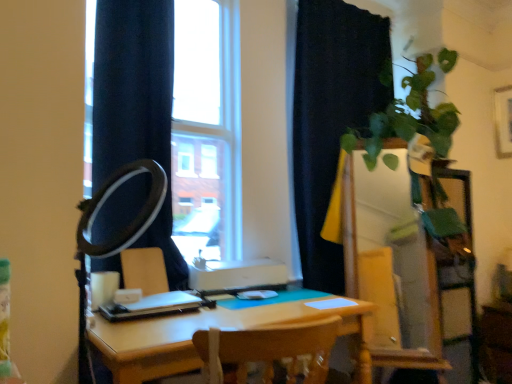
Question: Is black matte ring light at left facing away from green glossy dresser at right?

Choices:
 (A) yes
 (B) no

Answer: (B)

Question: Is black matte ring light at left outside of green glossy dresser at right?

Choices:
 (A) no
 (B) yes

Answer: (B)

Question: Does black matte ring light at left come behind green glossy dresser at right?

Choices:
 (A) no
 (B) yes

Answer: (A)

Question: From the image's perspective, does black matte ring light at left appear lower than green glossy dresser at right?

Choices:
 (A) yes
 (B) no

Answer: (B)

Question: Considering the relative positions of black matte ring light at left and green glossy dresser at right in the image provided, is black matte ring light at left in front of green glossy dresser at right?

Choices:
 (A) yes
 (B) no

Answer: (A)

Question: Are black matte ring light at left and green glossy dresser at right beside each other?

Choices:
 (A) no
 (B) yes

Answer: (A)

Question: Considering the relative sizes of matte white armchair at center and transparent glass window at center in the image provided, is matte white armchair at center shorter than transparent glass window at center?

Choices:
 (A) yes
 (B) no

Answer: (A)

Question: From a real-world perspective, is matte white armchair at center below transparent glass window at center?

Choices:
 (A) no
 (B) yes

Answer: (B)

Question: Does matte white armchair at center touch transparent glass window at center?

Choices:
 (A) yes
 (B) no

Answer: (B)

Question: Is matte white armchair at center positioned with its back to transparent glass window at center?

Choices:
 (A) yes
 (B) no

Answer: (A)

Question: Is matte white armchair at center not inside transparent glass window at center?

Choices:
 (A) yes
 (B) no

Answer: (B)

Question: Considering the relative sizes of matte white armchair at center and transparent glass window at center in the image provided, is matte white armchair at center bigger than transparent glass window at center?

Choices:
 (A) yes
 (B) no

Answer: (B)

Question: From the image's perspective, does matte white armchair at center appear lower than black matte curtain at upper right?

Choices:
 (A) yes
 (B) no

Answer: (A)